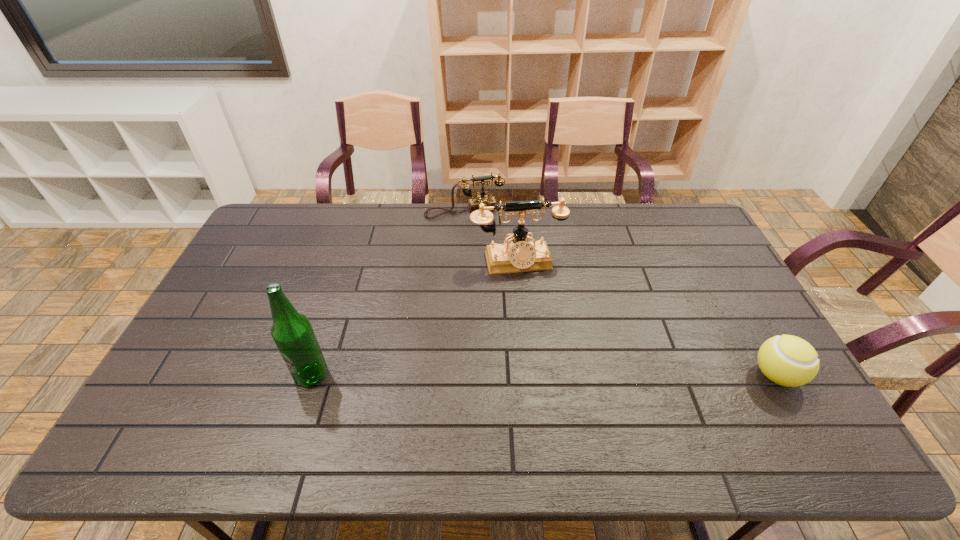
Where is `the tallest object`? The image size is (960, 540). the tallest object is located at coordinates (292, 332).

Identify the location of beer bottle. (292, 332).

Locate an element on the screen. This screenshot has width=960, height=540. the rightmost object is located at coordinates click(x=787, y=360).

Locate an element on the screen. the third shortest object is located at coordinates (519, 255).

At what (x,y) coordinates should I click in order to perform the action: click on the taller telephone. Please return your answer as a coordinate pair (x, y). This screenshot has width=960, height=540. Looking at the image, I should click on (519, 255).

This screenshot has height=540, width=960. In order to click on the shorter telephone in this screenshot , I will do `click(473, 204)`.

Where is `the farthest object`? The height and width of the screenshot is (540, 960). the farthest object is located at coordinates (473, 204).

Where is `vacant space positioned on the label of the tallest object`? This screenshot has height=540, width=960. vacant space positioned on the label of the tallest object is located at coordinates (300, 411).

Identify the location of free space located 0.050m on the front of the tennis ball. (799, 415).

This screenshot has width=960, height=540. I want to click on vacant area located on the dial of the third nearest object, so click(x=535, y=319).